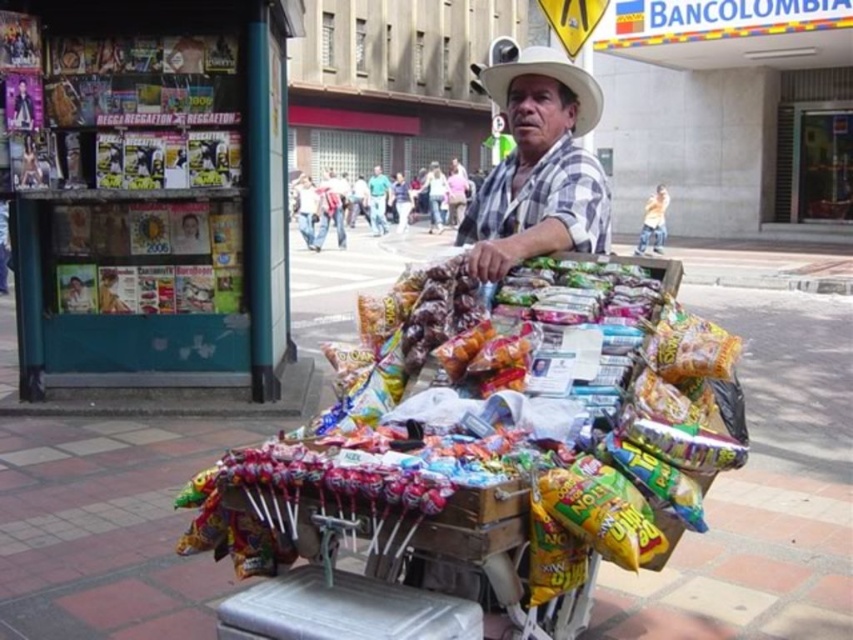
Which is above, multicolored plastic candy at center or white felt cowboy hat at center?

Positioned higher is white felt cowboy hat at center.

Is point (503, 474) less distant than point (544, 48)?

Yes.

Does point (549, 417) come in front of point (546, 51)?

Yes.

In order to click on multicolored plastic candy at center in this screenshot , I will do `click(498, 420)`.

Does white felt cowboy hat at center appear on the left side of green fabric shirt at center?

In fact, white felt cowboy hat at center is to the right of green fabric shirt at center.

Who is more distant from viewer, (572, 129) or (380, 216)?

Point (380, 216)

This screenshot has height=640, width=853. What do you see at coordinates (548, 76) in the screenshot?
I see `white felt cowboy hat at center` at bounding box center [548, 76].

Where is `white felt cowboy hat at center`? This screenshot has width=853, height=640. white felt cowboy hat at center is located at coordinates (548, 76).

Can you confirm if white checkered shirt at center is positioned above green fabric shirt at center?

No, white checkered shirt at center is not above green fabric shirt at center.

Can you confirm if white checkered shirt at center is taller than green fabric shirt at center?

In fact, white checkered shirt at center may be shorter than green fabric shirt at center.

Is point (489, 244) more distant than point (381, 204)?

No, (489, 244) is closer to viewer.

What are the coordinates of `white checkered shirt at center` in the screenshot? It's located at (538, 168).